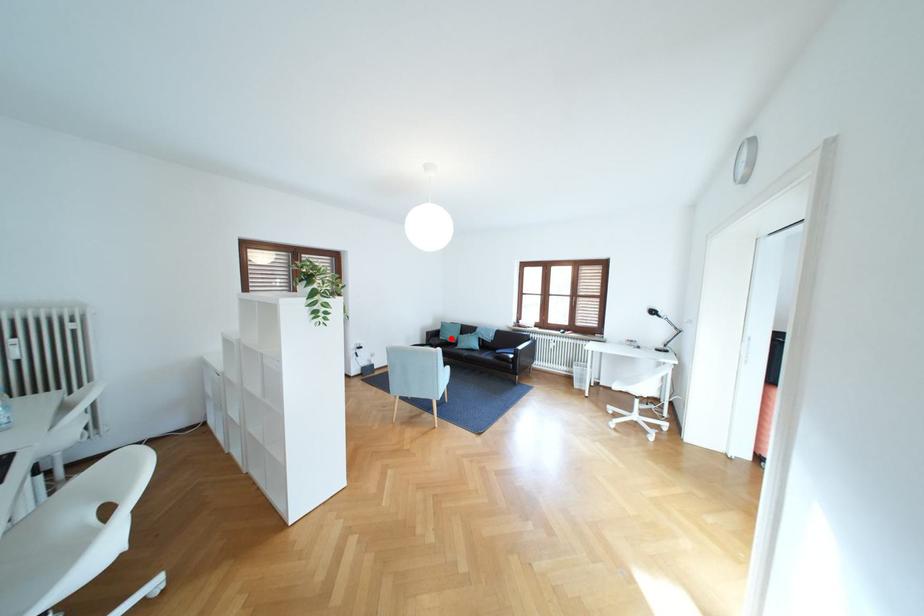
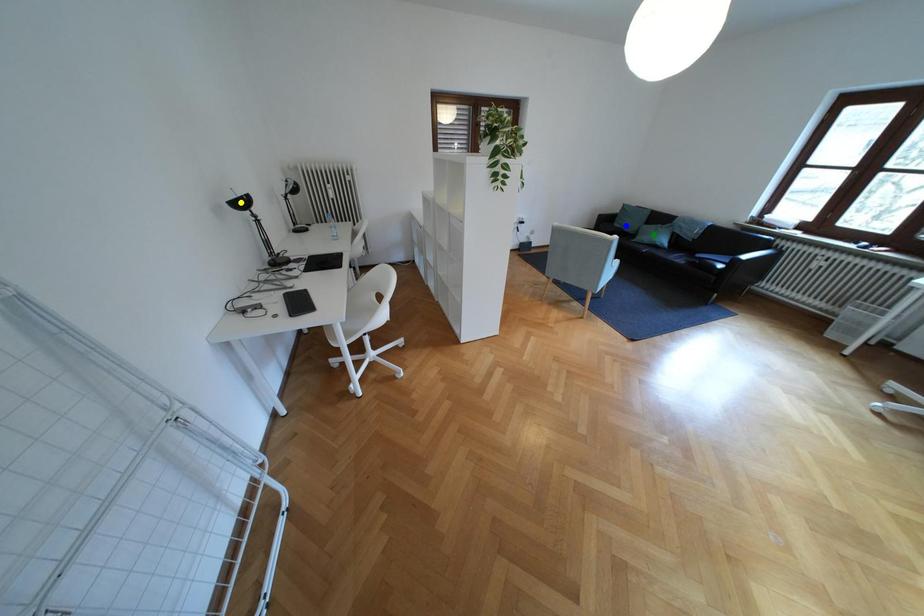
Question: I am providing you with two images of the same scene from different viewpoints. A red point is marked on the first image. You are given multiple points on the second image. Which point in image 2 is actually the same real-world point as the red point in image 1?

Choices:
 (A) green point
 (B) blue point
 (C) yellow point

Answer: (B)